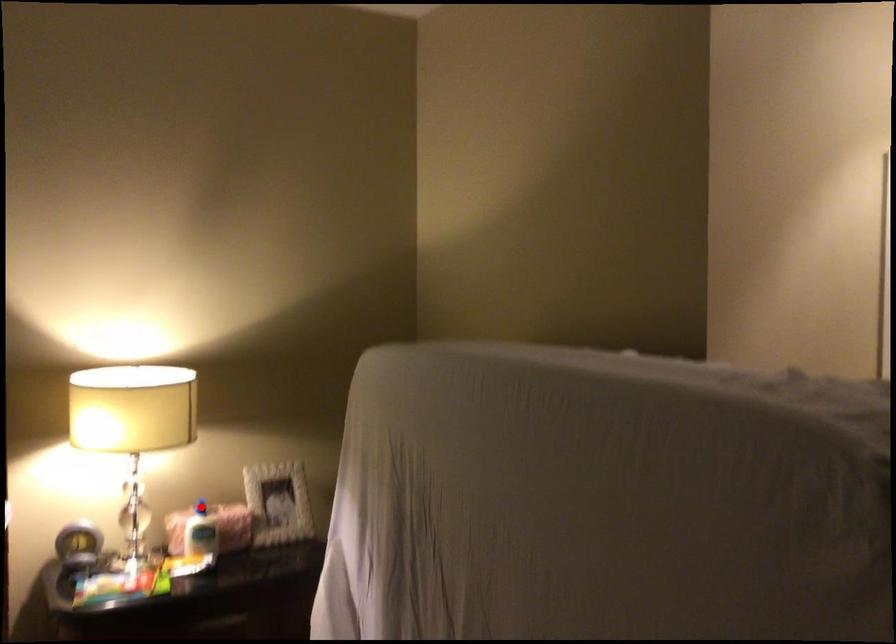
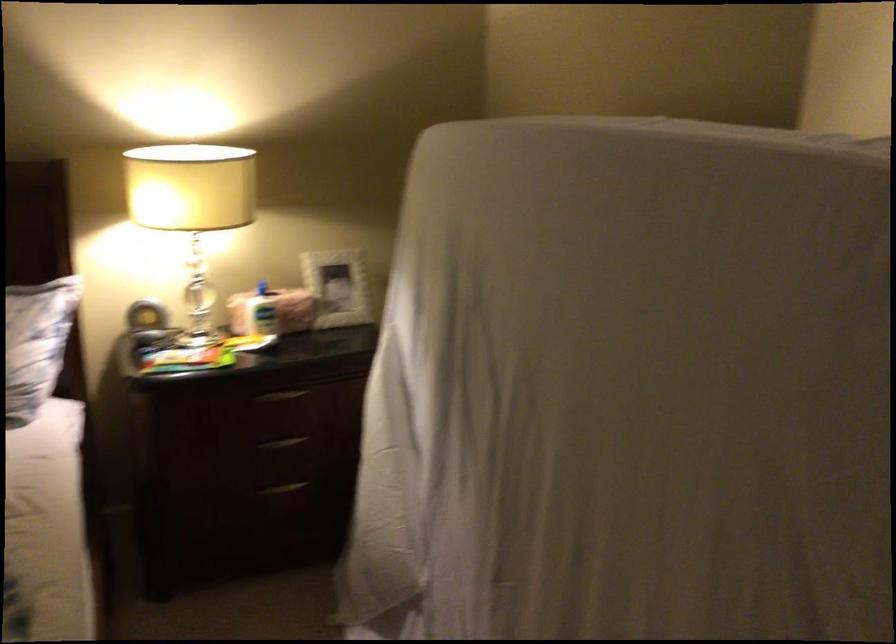
The point at the highlighted location is marked in the first image. Where is the corresponding point in the second image?

(262, 288)